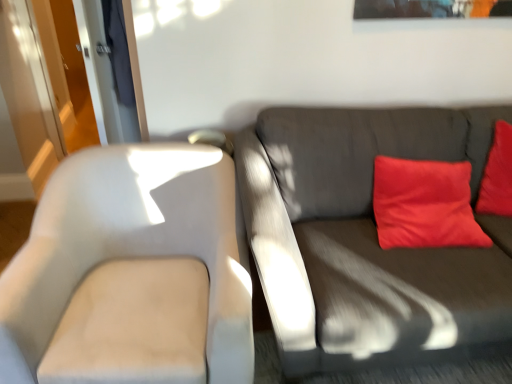
Question: From the image's perspective, is transparent glass door at upper left positioned above or below matte red pillow at upper right?

Choices:
 (A) below
 (B) above

Answer: (B)

Question: In terms of width, does transparent glass door at upper left look wider or thinner when compared to matte red pillow at upper right?

Choices:
 (A) thin
 (B) wide

Answer: (A)

Question: Which of these objects is positioned closest to the dark gray fabric couch at right?

Choices:
 (A) beige fabric chair at left
 (B) transparent glass door at upper left
 (C) matte red pillow at upper right

Answer: (C)

Question: Which is nearer to the dark gray fabric couch at right?

Choices:
 (A) transparent glass door at upper left
 (B) beige fabric chair at left
 (C) matte red pillow at upper right

Answer: (C)